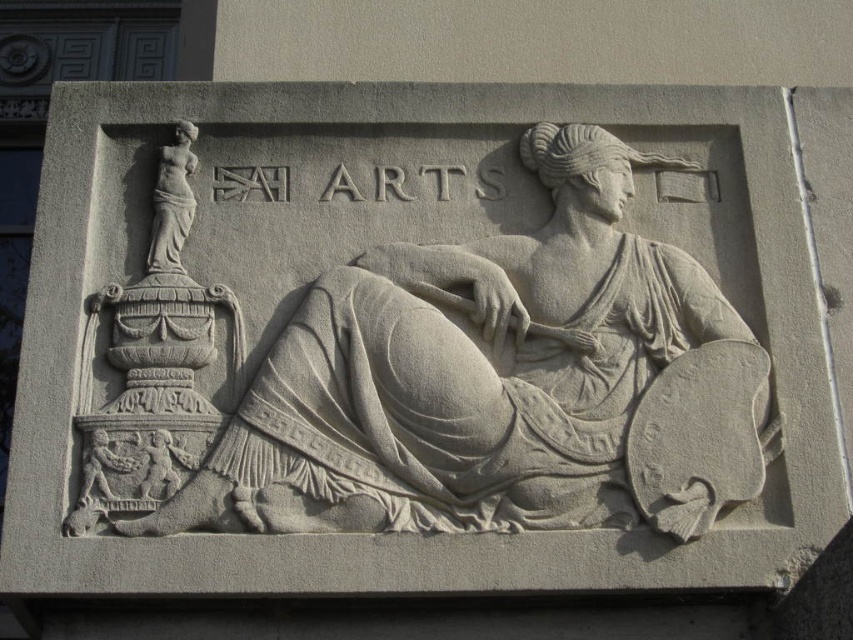
You are an art student analyzing the stone relief sculpture. You notice the white stone sculpture at center and the smooth white statue at upper left. Which one do you think is bigger in size?

The white stone sculpture at center is larger in size than the smooth white statue at upper left.

You are standing 50 meters away from the stone relief sculpture. You want to see a specific point at coordinates point [497,326] on the relief. Can you see this point clearly from your current position?

The distance of point [497,326] from viewer is 44.87 meters, so yes, you can see the point clearly from your current position since you are standing 50 meters away, which is farther than the point itself.

What is the object located at the coordinates point (x=496, y=381) in the image?

The point (x=496, y=381) indicates the white stone sculpture at center.